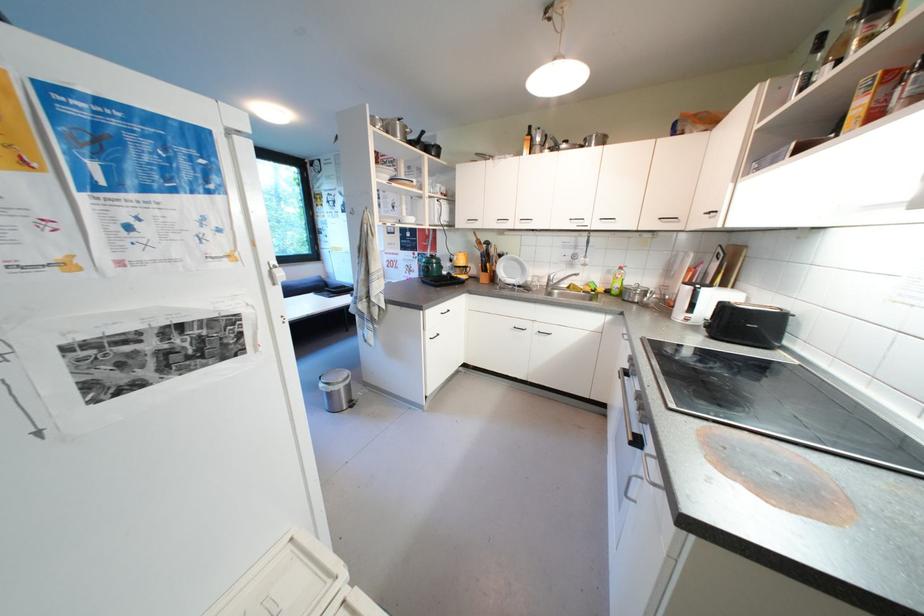
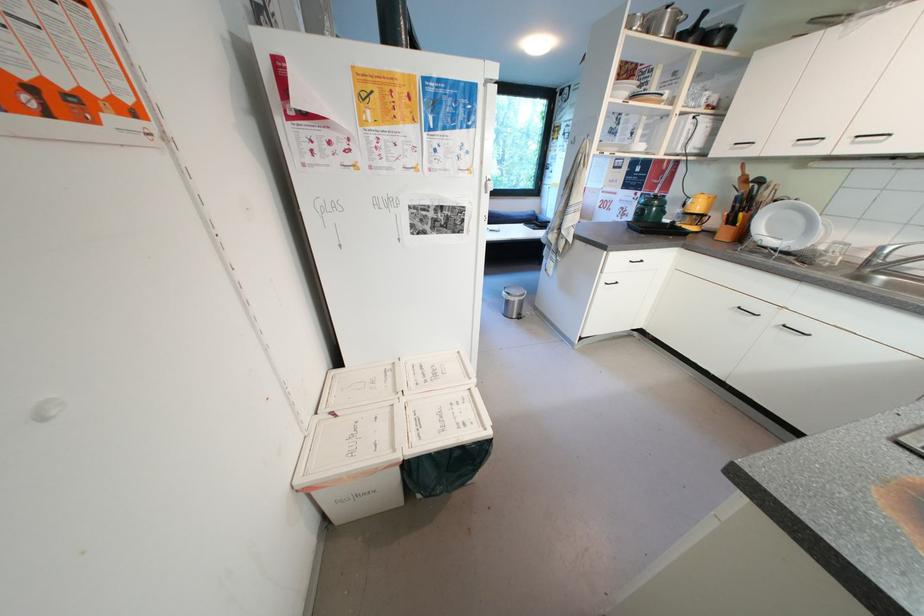
Locate, in the second image, the point that corresponds to the point at 396,134 in the first image.

(657, 33)